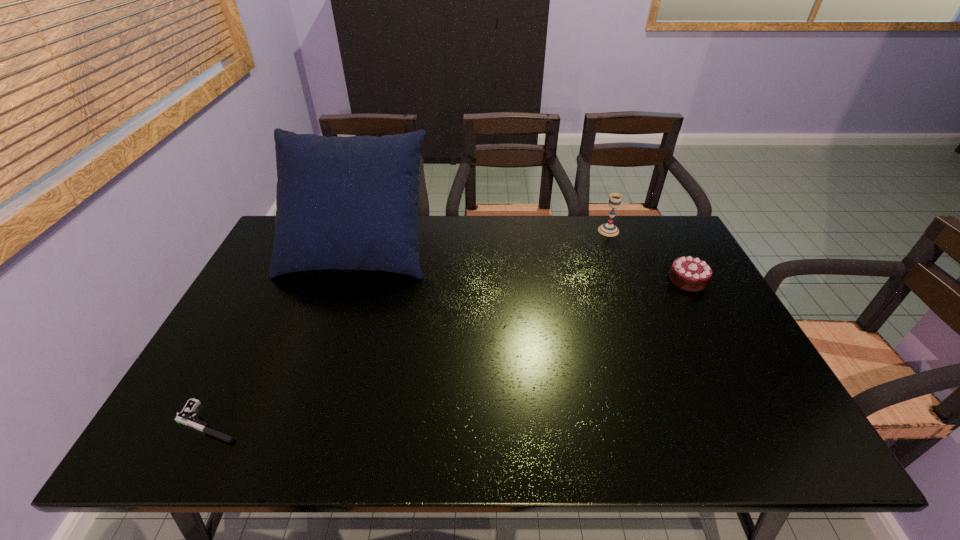
Where is `cushion`? cushion is located at coordinates (345, 203).

Where is `the second tallest object`? This screenshot has height=540, width=960. the second tallest object is located at coordinates (608, 229).

Identify the location of the second object from right to left. Image resolution: width=960 pixels, height=540 pixels. (608, 229).

The width and height of the screenshot is (960, 540). What are the coordinates of `the second shortest object` in the screenshot? It's located at (691, 274).

This screenshot has width=960, height=540. In order to click on chocolate cake in this screenshot , I will do `click(691, 274)`.

Locate an element on the screen. This screenshot has width=960, height=540. the nearest object is located at coordinates (186, 416).

The width and height of the screenshot is (960, 540). Identify the location of the shortest object. [186, 416].

Where is `free region located 0.350m on the facing side of the tallest object`? The image size is (960, 540). free region located 0.350m on the facing side of the tallest object is located at coordinates (311, 382).

Where is `free space located 0.070m on the right of the third shortest object`? free space located 0.070m on the right of the third shortest object is located at coordinates (639, 231).

Locate an element on the screen. free region located on the front of the third tallest object is located at coordinates (712, 326).